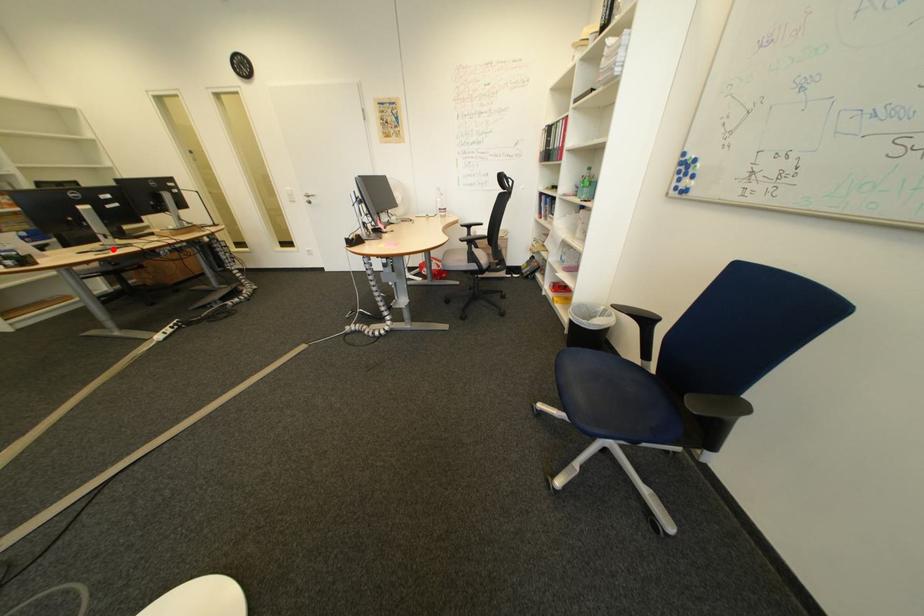
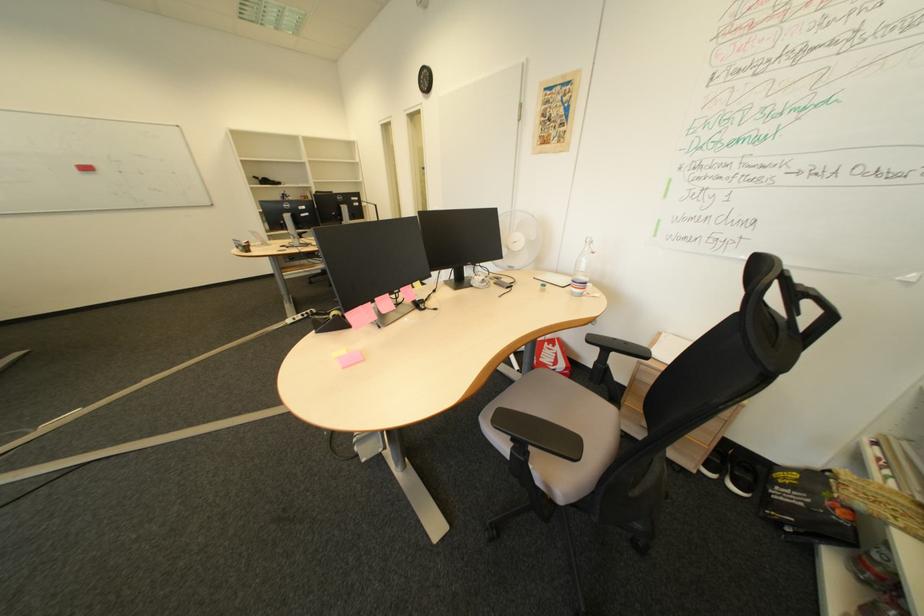
Question: I am providing you with two images of the same scene from different viewpoints. Given a red point in image1, look at the same physical point in image2. Is it:

Choices:
 (A) Closer to the viewpoint
 (B) Farther from the viewpoint

Answer: (A)